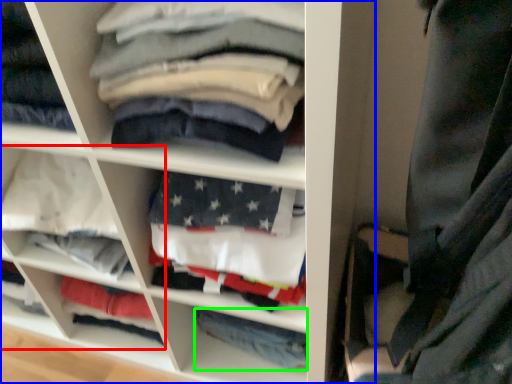
Question: Which object is the farthest from cabinet (highlighted by a red box)? Choose among these: shelf (highlighted by a blue box) or trousers (highlighted by a green box).

Choices:
 (A) shelf
 (B) trousers

Answer: (B)